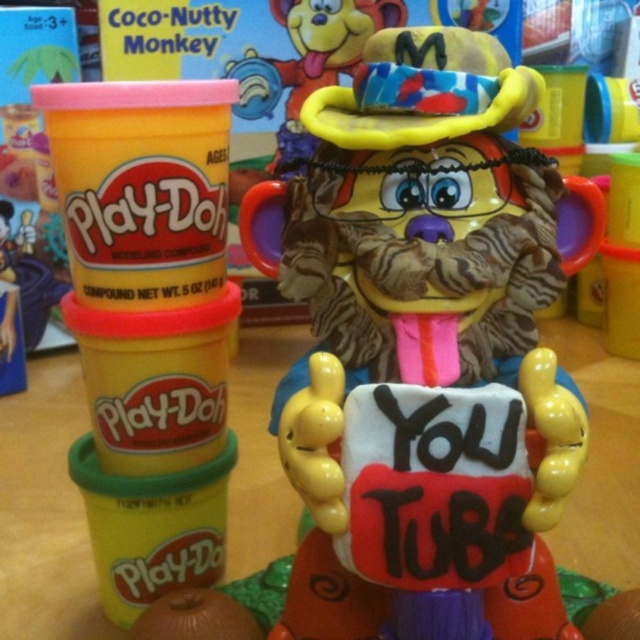
Can you confirm if matte plastic monkey at center is positioned below rubberized yellow ring at upper center?

Indeed, matte plastic monkey at center is positioned under rubberized yellow ring at upper center.

Is point (422, 72) farther from camera compared to point (296, 90)?

No, (422, 72) is in front of (296, 90).

Does point (374, 237) come farther from viewer compared to point (365, 8)?

No, it is in front of (365, 8).

Where is `matte plastic monkey at center`? matte plastic monkey at center is located at coordinates (426, 348).